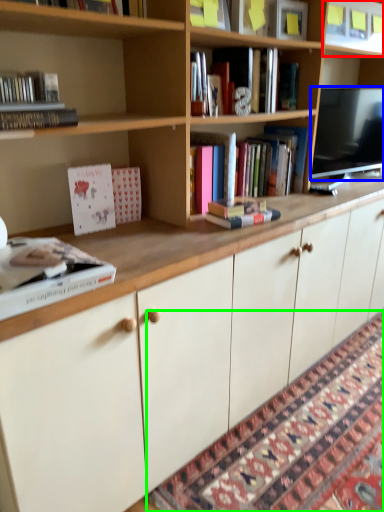
Question: Which is nearer to the shelf (highlighted by a red box)? television (highlighted by a blue box) or mat (highlighted by a green box).

Choices:
 (A) television
 (B) mat

Answer: (A)